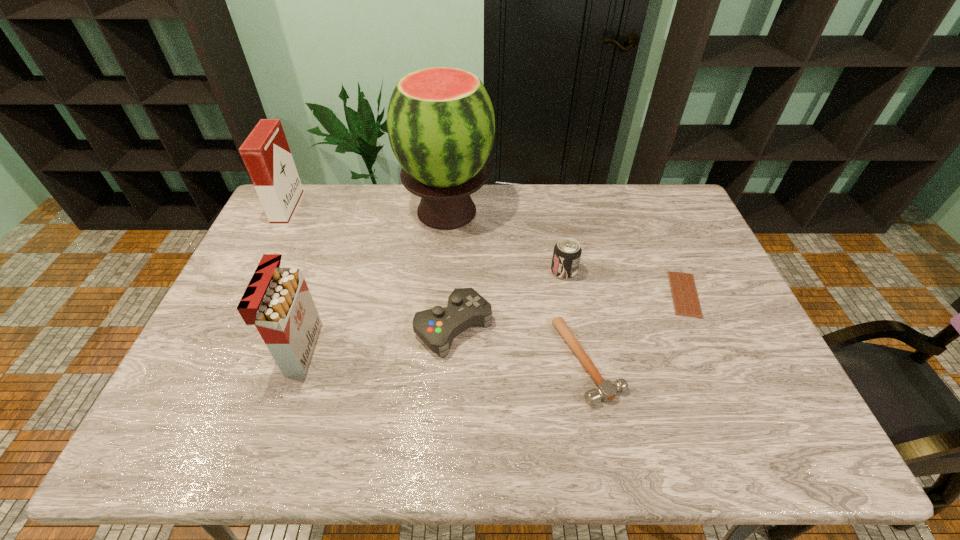
You are a GUI agent. You are given a task and a screenshot of the screen. Output one action in this format:
    pyautogui.click(x=<x>, y=<y>)
    Task: Click on the vacant space located 0.390m on the right of the watermelon
    This screenshot has width=960, height=540.
    Given the screenshot: What is the action you would take?
    pyautogui.click(x=603, y=211)

Locate an element on the screen. The width and height of the screenshot is (960, 540). vacant position located 0.100m on the front-facing side of the leftmost object is located at coordinates (325, 210).

The image size is (960, 540). I want to click on vacant area situated 0.350m with the lid open on the nearer cigarette case, so click(448, 349).

Image resolution: width=960 pixels, height=540 pixels. I want to click on blank area located on the right of the soda can, so click(x=681, y=272).

Find the location of `free region located 0.140m on the right of the fifth tallest object`. free region located 0.140m on the right of the fifth tallest object is located at coordinates (543, 327).

The width and height of the screenshot is (960, 540). Identify the location of free location located 0.050m on the left of the sixth tallest object. [x=537, y=361].

Where is `free spot located on the front of the shortest object`? The height and width of the screenshot is (540, 960). free spot located on the front of the shortest object is located at coordinates (708, 348).

Identify the location of watermelon at the far edge. The height and width of the screenshot is (540, 960). (441, 126).

Find the location of `cigarette_case located in the far edge section of the desktop`. cigarette_case located in the far edge section of the desktop is located at coordinates (266, 154).

Image resolution: width=960 pixels, height=540 pixels. I want to click on object that is positioned at the left edge, so click(x=266, y=154).